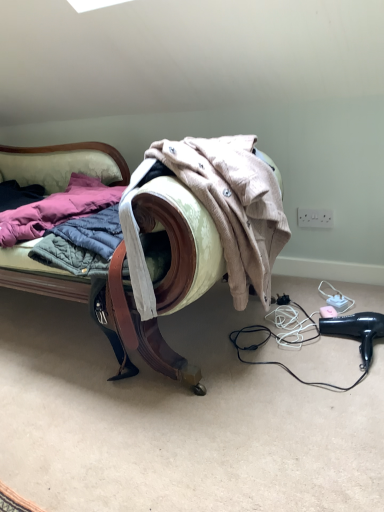
Where is `free point in front of black plastic hair dryer at lower right`? Image resolution: width=384 pixels, height=512 pixels. free point in front of black plastic hair dryer at lower right is located at coordinates (357, 387).